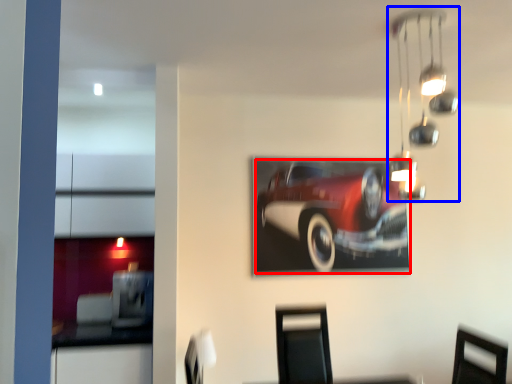
Question: Among these objects, which one is farthest to the camera, car (highlighted by a red box) or lamp (highlighted by a blue box)?

Choices:
 (A) car
 (B) lamp

Answer: (A)